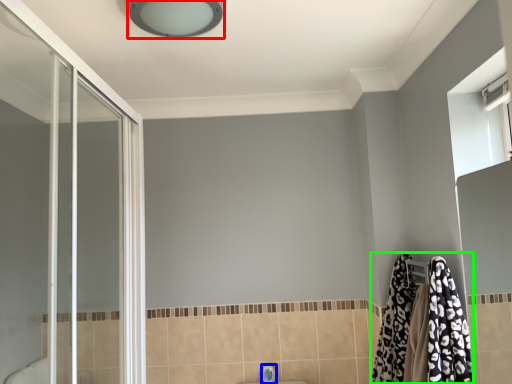
Question: Which is nearer to the light fixture (highlighted by a red box)? faucet (highlighted by a blue box) or bathrobe (highlighted by a green box).

Choices:
 (A) faucet
 (B) bathrobe

Answer: (B)